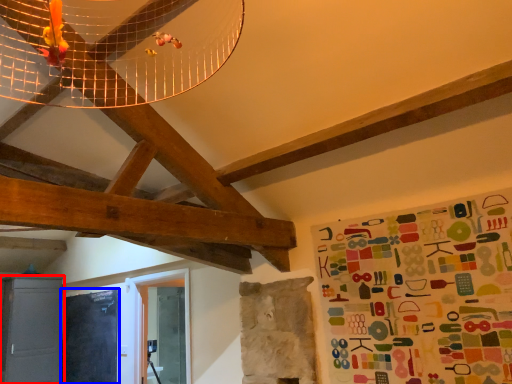
Question: Which object is closer to the camera taking this photo, cabinetry (highlighted by a red box) or bulletin board (highlighted by a blue box)?

Choices:
 (A) cabinetry
 (B) bulletin board

Answer: (B)